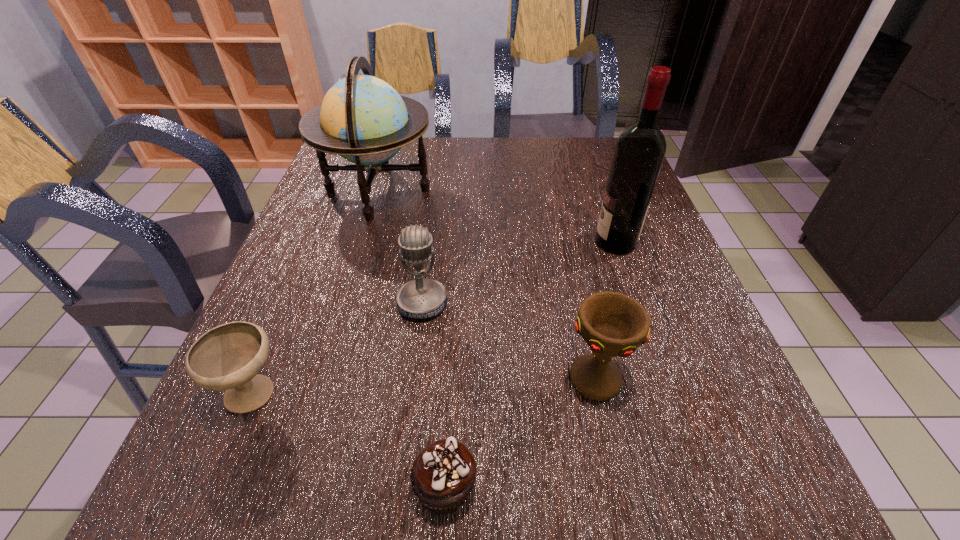
In order to click on vacant region between the nearest object and the shorter chalice in this screenshot , I will do click(349, 441).

I want to click on free space that is in between the fourth tallest object and the microphone, so click(509, 341).

The width and height of the screenshot is (960, 540). Identify the location of object that can be found as the fifth closest to the shorter chalice. (639, 152).

Identify which object is located as the third nearest to the alcohol. Please provide its 2D coordinates. Your answer should be formatted as a tuple, i.e. [(x, y)], where the tuple contains the x and y coordinates of a point satisfying the conditions above.

[(362, 118)]

At what (x,y) coordinates should I click in order to perform the action: click on vacant region that satisfies the following two spatial constraints: 1. on the back side of the left chalice; 2. on the left side of the fifth object from left to right. Please return your answer as a coordinate pair (x, y). Looking at the image, I should click on (260, 379).

This screenshot has width=960, height=540. I want to click on vacant position in the image that satisfies the following two spatial constraints: 1. on the surface of the cupcake; 2. on the right side of the farthest object, so click(289, 487).

In order to click on vacant region that satisfies the following two spatial constraints: 1. on the surface of the farthest object; 2. on the right side of the cupcake in this screenshot , I will do `click(289, 487)`.

Where is `free spot that satisfies the following two spatial constraints: 1. on the surface of the fifth shortest object; 2. on the right side of the shortest object`? This screenshot has width=960, height=540. free spot that satisfies the following two spatial constraints: 1. on the surface of the fifth shortest object; 2. on the right side of the shortest object is located at coordinates (289, 487).

This screenshot has height=540, width=960. Identify the location of free region that satisfies the following two spatial constraints: 1. on the front-facing side of the right chalice; 2. on the right side of the microphone. point(413,379).